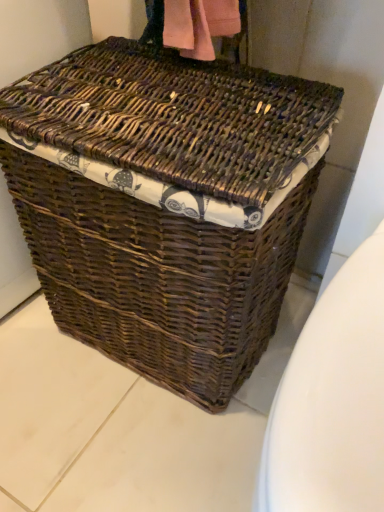
Question: Based on their sizes in the image, would you say white glossy toilet bowl at lower right is bigger or smaller than brown wicker picnic basket at center?

Choices:
 (A) big
 (B) small

Answer: (B)

Question: Would you say white glossy toilet bowl at lower right is to the left or to the right of brown wicker picnic basket at center in the picture?

Choices:
 (A) right
 (B) left

Answer: (A)

Question: From a real-world perspective, is white glossy toilet bowl at lower right physically located above or below brown wicker picnic basket at center?

Choices:
 (A) below
 (B) above

Answer: (A)

Question: In the image, is brown wicker picnic basket at center positioned in front of or behind white glossy toilet bowl at lower right?

Choices:
 (A) behind
 (B) front

Answer: (A)

Question: Is point (62, 274) closer or farther from the camera than point (345, 332)?

Choices:
 (A) closer
 (B) farther

Answer: (B)

Question: Considering the positions of brown wicker picnic basket at center and white glossy toilet bowl at lower right in the image, is brown wicker picnic basket at center taller or shorter than white glossy toilet bowl at lower right?

Choices:
 (A) short
 (B) tall

Answer: (B)

Question: Which is correct: brown wicker picnic basket at center is inside white glossy toilet bowl at lower right, or outside of it?

Choices:
 (A) inside
 (B) outside

Answer: (B)